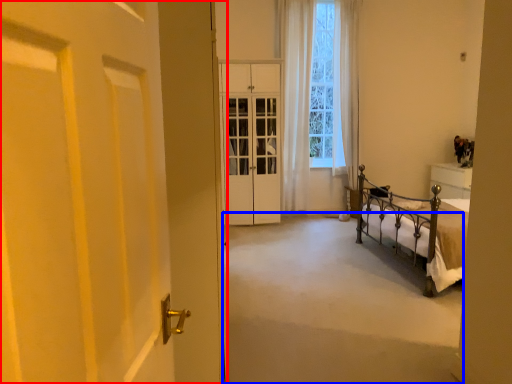
Question: Among these objects, which one is nearest to the camera, door (highlighted by a red box) or corridor (highlighted by a blue box)?

Choices:
 (A) door
 (B) corridor

Answer: (A)